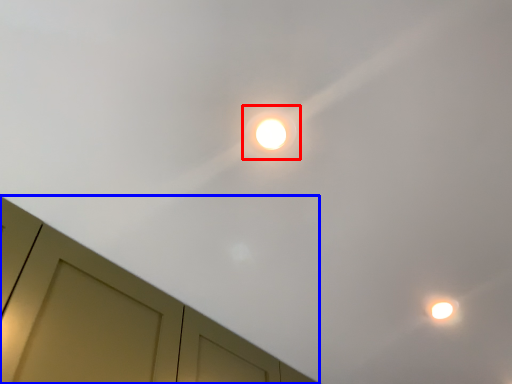
Question: Which point is closer to the camera, droplight (highlighted by a red box) or dresser (highlighted by a blue box)?

Choices:
 (A) droplight
 (B) dresser

Answer: (B)